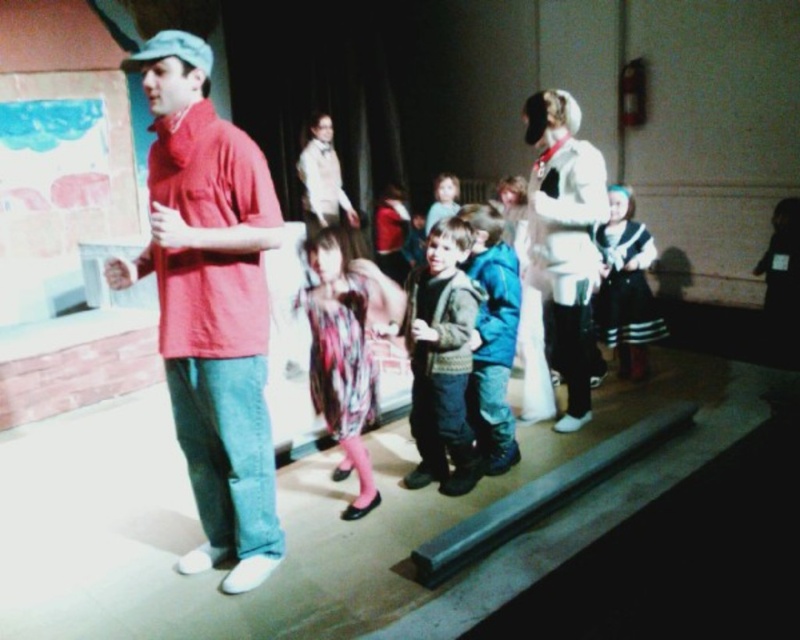
Does floral dress at center have a larger size compared to blue fleece jacket at center?

Correct, floral dress at center is larger in size than blue fleece jacket at center.

Can you confirm if floral dress at center is positioned to the right of blue fleece jacket at center?

No, floral dress at center is not to the right of blue fleece jacket at center.

Is point (348, 509) positioned before point (504, 369)?

Yes, it is.

Image resolution: width=800 pixels, height=640 pixels. What are the coordinates of `floral dress at center` in the screenshot? It's located at (340, 360).

Is green fuzzy jacket at center to the right of fluffy pink sweater at center from the viewer's perspective?

Incorrect, green fuzzy jacket at center is not on the right side of fluffy pink sweater at center.

The image size is (800, 640). Find the location of `green fuzzy jacket at center`. green fuzzy jacket at center is located at coordinates (442, 360).

Does matte red shirt at left have a smaller size compared to green fuzzy jacket at center?

Actually, matte red shirt at left might be larger than green fuzzy jacket at center.

Which is below, matte red shirt at left or green fuzzy jacket at center?

Positioned lower is green fuzzy jacket at center.

Which is in front, point (277, 557) or point (436, 307)?

Point (277, 557) is in front.

This screenshot has width=800, height=640. I want to click on matte red shirt at left, so click(x=210, y=304).